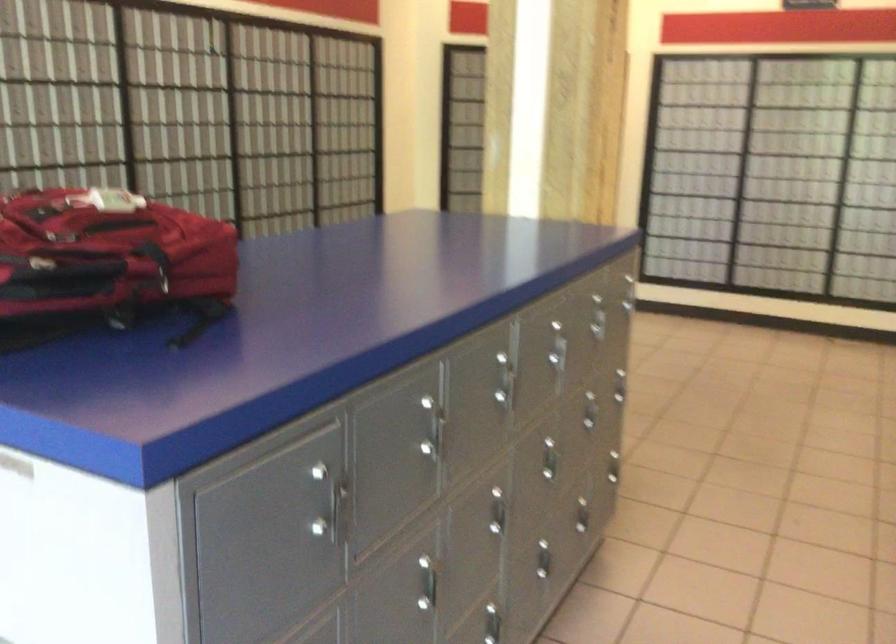
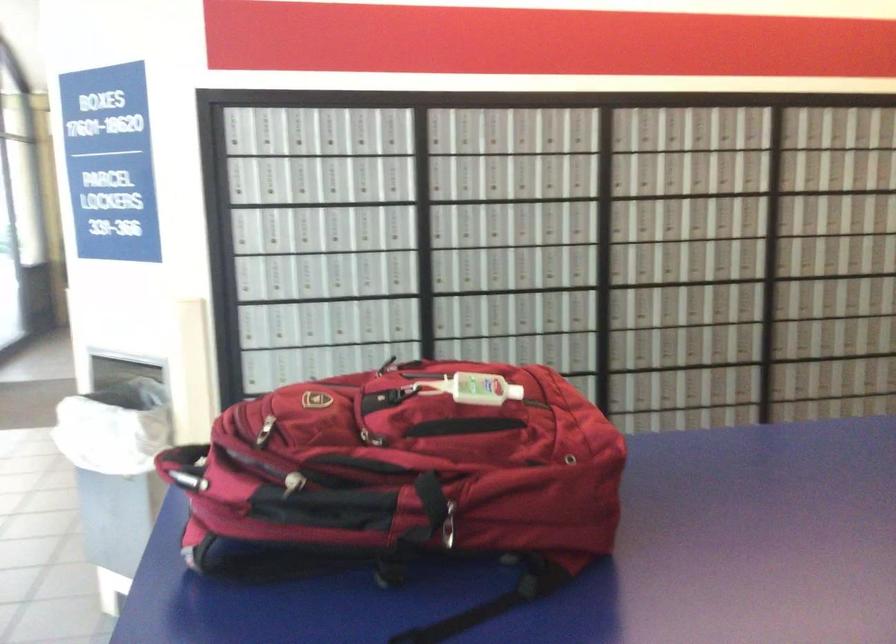
The point at (115, 196) is marked in the first image. Where is the corresponding point in the second image?

(471, 389)